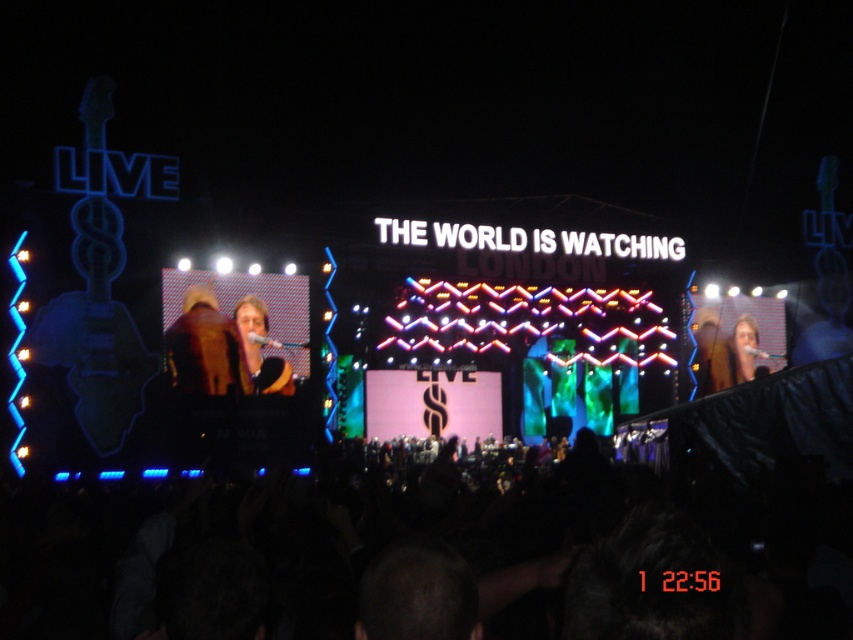
Looking at this image, in the concert scene, you notice a light brown leather jacket at center and a smooth skin face at right. Which object occupies a larger area in the image?

The smooth skin face at right occupies a larger area in the image compared to the light brown leather jacket at center.

You are a photographer at the concert. You want to capture a photo that includes both the brown leather jacket at center and the smooth skin face at right. Which object should you adjust your camera focus to first to ensure it fits in the frame?

The brown leather jacket at center has a lesser width compared to smooth skin face at right, so you should adjust your camera focus to the smooth skin face at right first to accommodate its larger size.